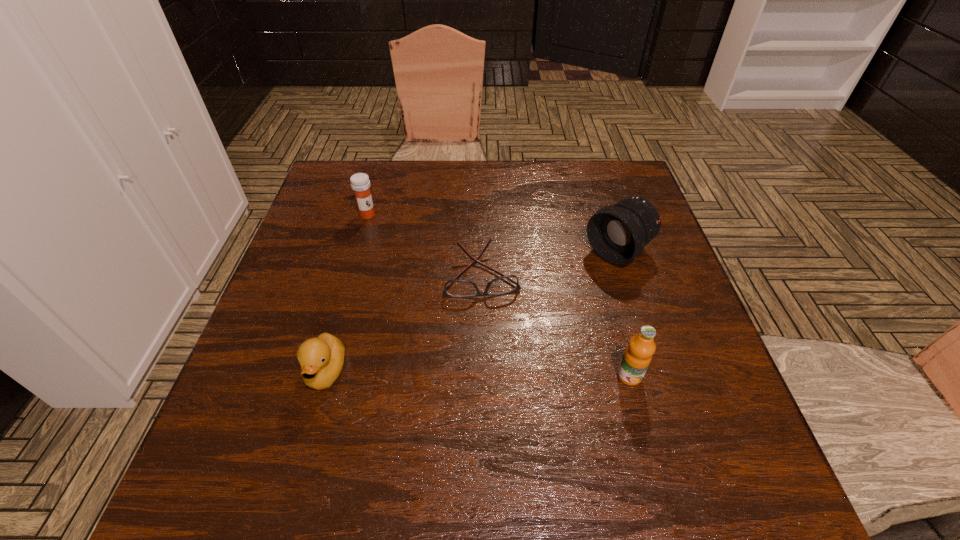
What are the coordinates of `vacant space that is in between the duckling and the third object from left to right` in the screenshot? It's located at (404, 323).

I want to click on free spot between the duckling and the telephoto lens, so click(472, 312).

Locate an element on the screen. The image size is (960, 540). vacant region between the telephoto lens and the third object from right to left is located at coordinates (550, 262).

Image resolution: width=960 pixels, height=540 pixels. What are the coordinates of `empty location between the spectacles and the farthest object` in the screenshot? It's located at (424, 244).

Identify the location of vacant area that lies between the orange juice and the duckling. This screenshot has width=960, height=540. (478, 374).

Image resolution: width=960 pixels, height=540 pixels. Find the location of `vacant space that is in between the orange juice and the duckling`. vacant space that is in between the orange juice and the duckling is located at coordinates (478, 374).

Identify the location of free spot between the orange juice and the farthest object. The image size is (960, 540). (498, 295).

The height and width of the screenshot is (540, 960). Find the location of `empty space between the telephoto lens and the shortest object`. empty space between the telephoto lens and the shortest object is located at coordinates (550, 262).

This screenshot has width=960, height=540. I want to click on unoccupied area between the telephoto lens and the orange juice, so click(623, 314).

Locate an element on the screen. The width and height of the screenshot is (960, 540). the second closest object to the orange juice is located at coordinates (618, 234).